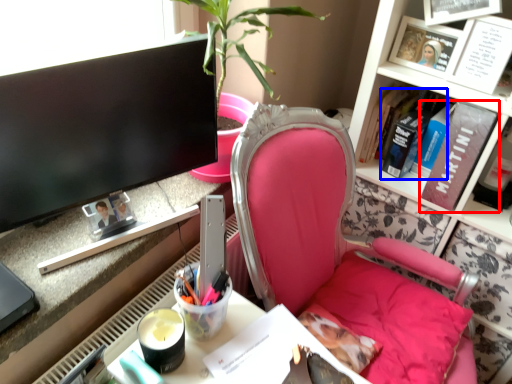
Question: Which object appears closest to the camera in this image, book (highlighted by a red box) or book (highlighted by a blue box)?

Choices:
 (A) book
 (B) book

Answer: (A)